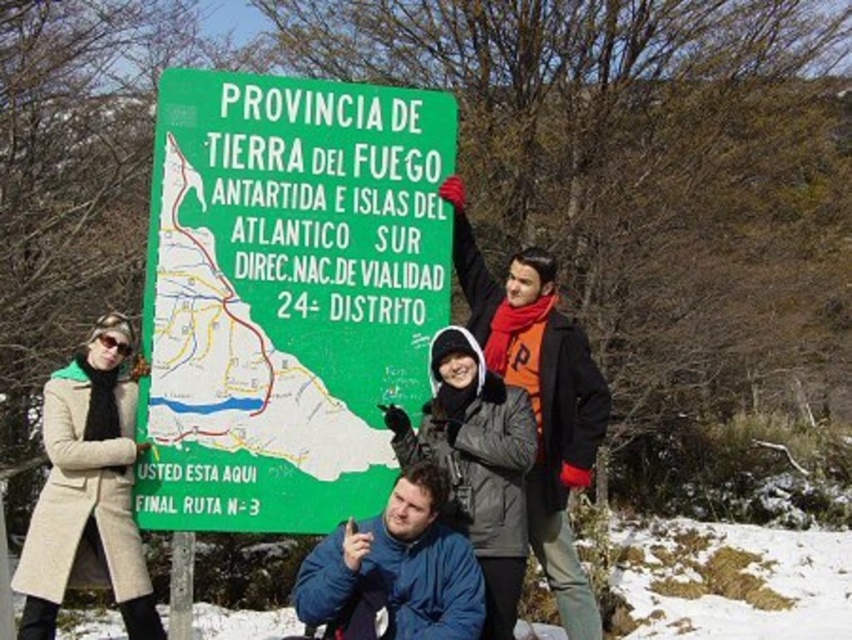
Question: Does beige wool coat at left have a greater width compared to dark blue jacket at center?

Choices:
 (A) no
 (B) yes

Answer: (A)

Question: Among these objects, which one is nearest to the camera?

Choices:
 (A) dark blue jacket at center
 (B) blue fleece jacket at lower center
 (C) green matte sign at upper center
 (D) beige wool coat at left

Answer: (B)

Question: Can you confirm if green matte sign at upper center is positioned to the left of beige wool coat at left?

Choices:
 (A) yes
 (B) no

Answer: (B)

Question: Which point is farther to the camera?

Choices:
 (A) dark blue jacket at center
 (B) beige wool coat at left

Answer: (A)

Question: Considering the real-world distances, which object is farthest from the green matte sign at upper center?

Choices:
 (A) blue fleece jacket at lower center
 (B) beige wool coat at left

Answer: (B)

Question: Does beige wool coat at left appear over blue fleece jacket at lower center?

Choices:
 (A) no
 (B) yes

Answer: (B)